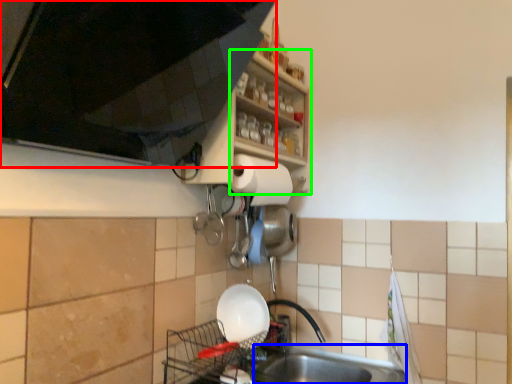
Question: Estimate the real-world distances between objects in this image. Which object is farther from cabinetry (highlighted by a red box), sink (highlighted by a blue box) or shelf (highlighted by a green box)?

Choices:
 (A) sink
 (B) shelf

Answer: (A)